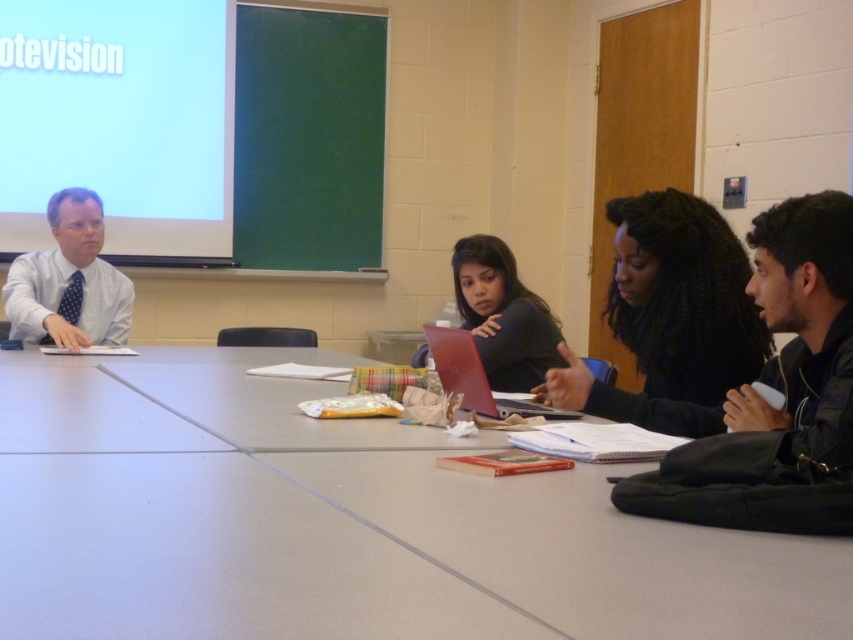
Between matte white projector screen at upper left and black leather jacket at right, which one appears on the left side from the viewer's perspective?

Positioned to the left is matte white projector screen at upper left.

Is point (144, 93) positioned behind point (809, 284)?

Yes, it is.

Identify the location of matte white projector screen at upper left. (120, 124).

Locate an element on the screen. The width and height of the screenshot is (853, 640). matte white projector screen at upper left is located at coordinates (120, 124).

Consider the image. Can you confirm if smooth gray table at center is smaller than matte white projector screen at upper left?

Yes.

Is smooth gray table at center in front of matte white projector screen at upper left?

Yes, it is.

This screenshot has width=853, height=640. Describe the element at coordinates (341, 524) in the screenshot. I see `smooth gray table at center` at that location.

The image size is (853, 640). What are the coordinates of `smooth gray table at center` in the screenshot? It's located at (341, 524).

Consider the image. Is black matte hair at center above black leather jacket at right?

Correct, black matte hair at center is located above black leather jacket at right.

Can you confirm if black matte hair at center is wider than black leather jacket at right?

Yes, black matte hair at center is wider than black leather jacket at right.

Between point (691, 404) and point (815, 460), which one is positioned in front?

Point (815, 460) is more forward.

Identify the location of black matte hair at center. (671, 317).